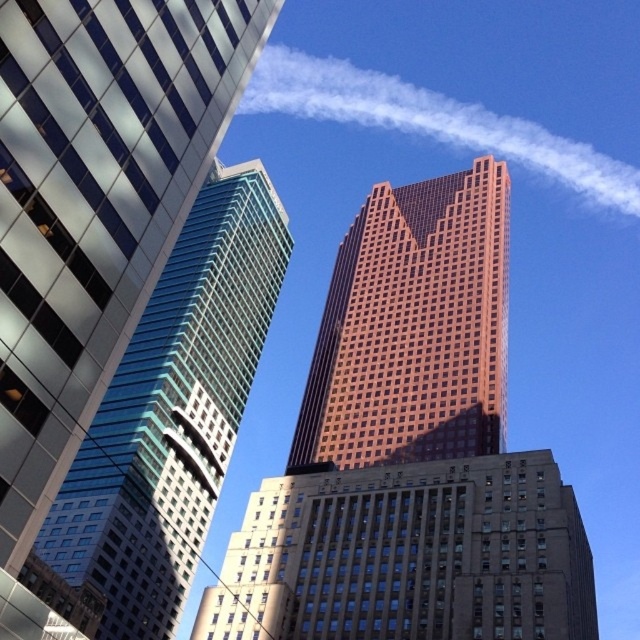
From the picture: Is glassy teal skyscraper at center-left below orange glass skyscraper at center?

Actually, glassy teal skyscraper at center-left is above orange glass skyscraper at center.

Is point (230, 273) more distant than point (380, 266)?

No, it is in front of (380, 266).

The height and width of the screenshot is (640, 640). Identify the location of glassy teal skyscraper at center-left. (168, 419).

Based on the photo, can you confirm if brown brick building at center is taller than white vapor at upper center?

In fact, brown brick building at center may be shorter than white vapor at upper center.

Who is more forward, (250, 516) or (384, 106)?

Point (250, 516) is in front.

Which is in front, point (428, 483) or point (250, 84)?

Positioned in front is point (428, 483).

Find the location of a particular element. The height and width of the screenshot is (640, 640). brown brick building at center is located at coordinates (408, 556).

Is brown brick building at center smaller than glassy teal skyscraper at center-left?

Yes.

Is brown brick building at center bigger than glassy teal skyscraper at center-left?

No, brown brick building at center is not bigger than glassy teal skyscraper at center-left.

The width and height of the screenshot is (640, 640). I want to click on brown brick building at center, so click(x=408, y=556).